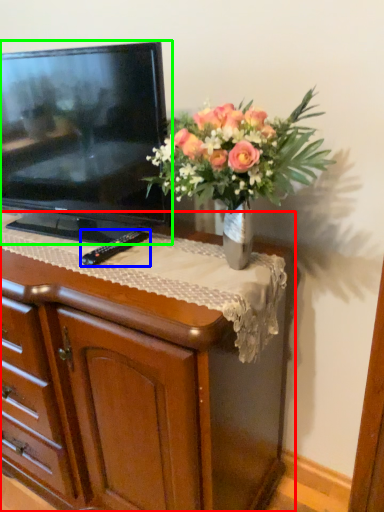
Question: Which object is positioned farthest from chest of drawers (highlighted by a red box)? Select from remote (highlighted by a blue box) and television (highlighted by a green box).

Choices:
 (A) remote
 (B) television

Answer: (A)